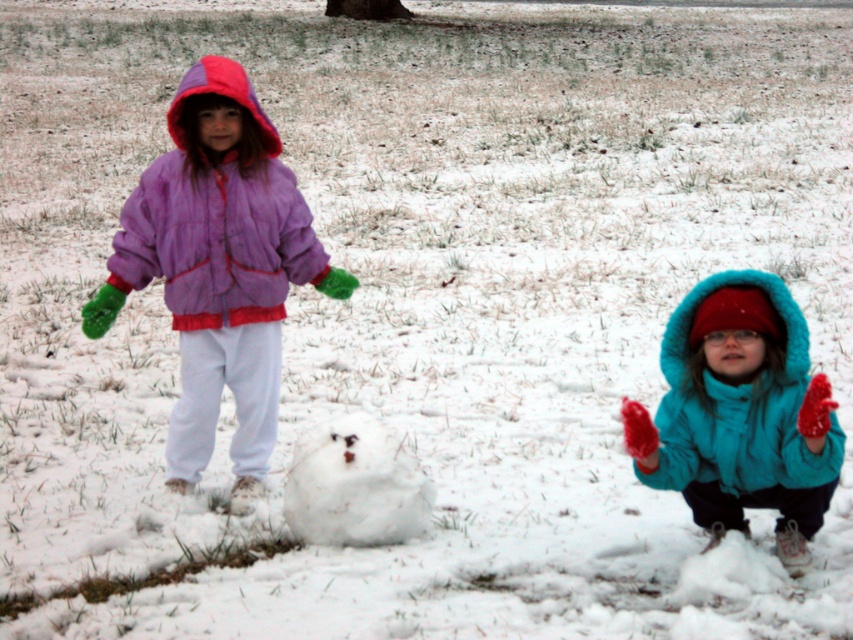
Question: Considering the real-world distances, which object is closest to the purple fleece jacket at upper left?

Choices:
 (A) matte purple jacket at left
 (B) turquoise fleece jacket at lower right
 (C) white fluffy snowman at center

Answer: (A)

Question: Based on their relative distances, which object is farther from the matte purple jacket at left?

Choices:
 (A) white fluffy snowman at center
 (B) purple fleece jacket at upper left

Answer: (A)

Question: Does matte purple jacket at left appear under purple fleece jacket at upper left?

Choices:
 (A) no
 (B) yes

Answer: (B)

Question: Is matte purple jacket at left bigger than turquoise fleece jacket at lower right?

Choices:
 (A) no
 (B) yes

Answer: (B)

Question: Among these objects, which one is nearest to the camera?

Choices:
 (A) matte purple jacket at left
 (B) purple fleece jacket at upper left
 (C) white fluffy snowman at center
 (D) turquoise fleece jacket at lower right

Answer: (D)

Question: Does matte purple jacket at left appear on the right side of white fluffy snowman at center?

Choices:
 (A) no
 (B) yes

Answer: (A)